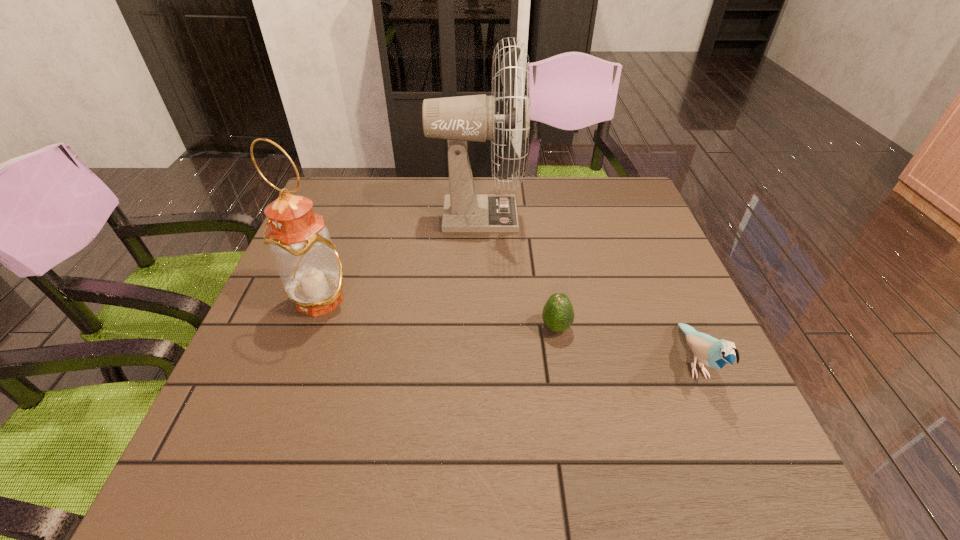
Find the location of a particular element. vacant space in between the third shortest object and the bird is located at coordinates (508, 331).

Locate an element on the screen. This screenshot has height=540, width=960. free space between the second object from left to right and the second object from right to left is located at coordinates (516, 272).

Where is `free area in between the second shortest object and the third shortest object`? This screenshot has width=960, height=540. free area in between the second shortest object and the third shortest object is located at coordinates (508, 331).

At what (x,y) coordinates should I click in order to perform the action: click on free spot between the farthest object and the oil lamp. Please return your answer as a coordinate pair (x, y). The image size is (960, 540). Looking at the image, I should click on (399, 258).

The image size is (960, 540). I want to click on vacant area that lies between the bird and the second object from left to right, so click(586, 289).

Find the location of a particular element. blank region between the leftmost object and the shortest object is located at coordinates (439, 314).

Where is `free area in between the fan and the oil lamp`? The height and width of the screenshot is (540, 960). free area in between the fan and the oil lamp is located at coordinates (399, 258).

Locate an element on the screen. empty space between the third tallest object and the avocado is located at coordinates (625, 345).

This screenshot has height=540, width=960. I want to click on free area in between the second object from left to right and the oil lamp, so click(x=399, y=258).

Where is `free space between the farthest object and the avocado`? This screenshot has width=960, height=540. free space between the farthest object and the avocado is located at coordinates (516, 272).